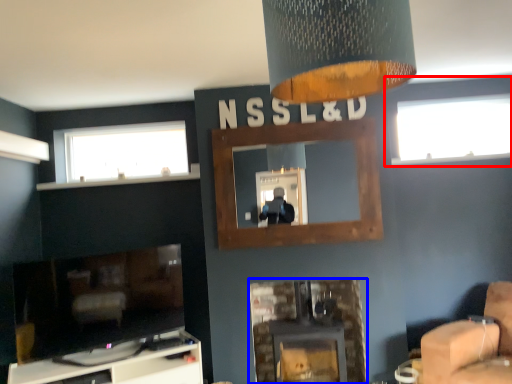
Question: Which object is closer to the camera taking this photo, window (highlighted by a red box) or fireplace (highlighted by a blue box)?

Choices:
 (A) window
 (B) fireplace

Answer: (B)